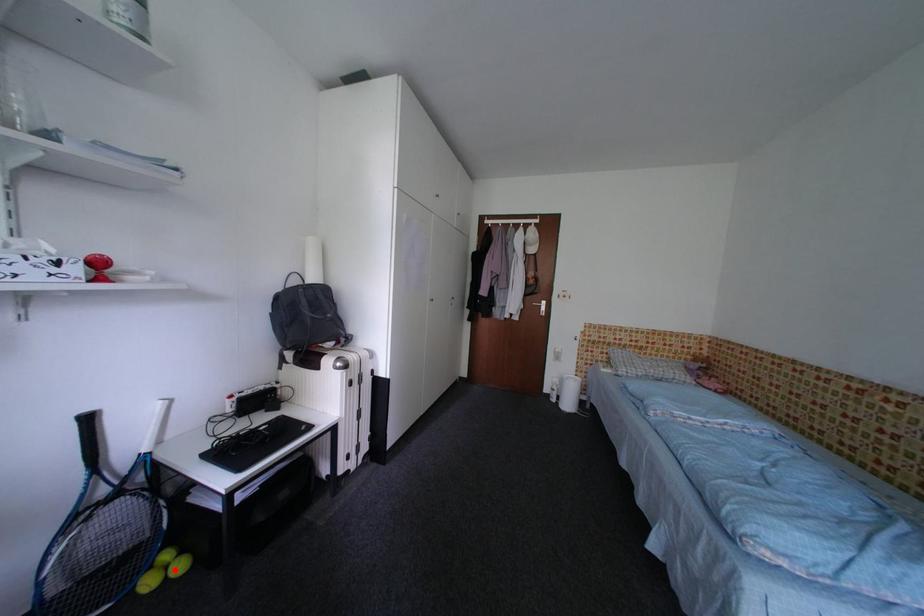
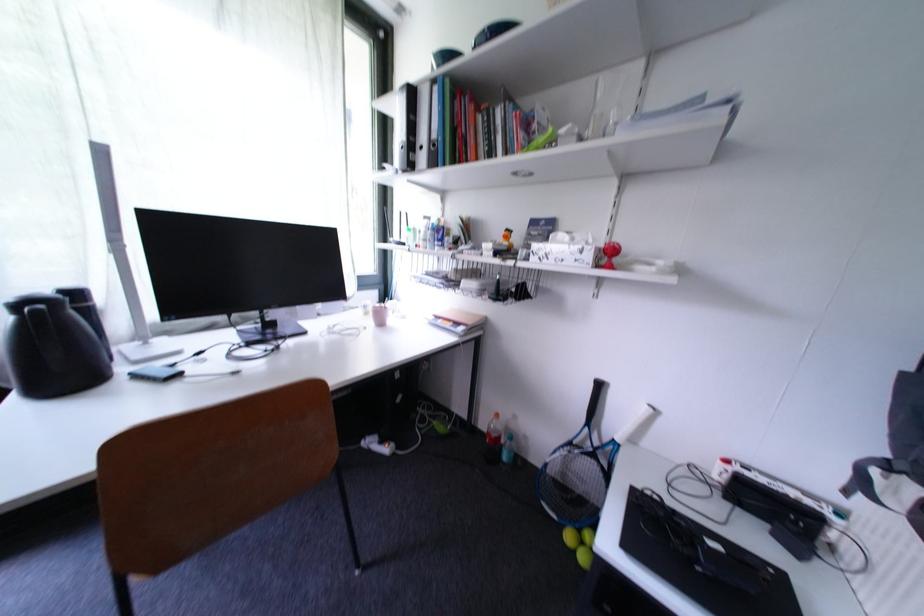
Question: I am providing you with two images of the same scene from different viewpoints. Image1 has a red point marked. In image2, the corresponding 3D location appears at what relative position? Reply with the corresponding letter.

Choices:
 (A) Closer
 (B) Farther

Answer: (B)